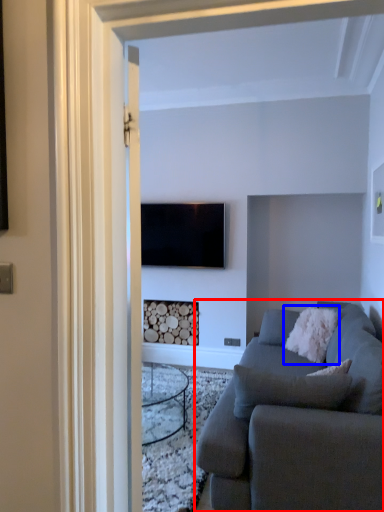
Question: Among these objects, which one is farthest to the camera, studio couch (highlighted by a red box) or pillow (highlighted by a blue box)?

Choices:
 (A) studio couch
 (B) pillow

Answer: (B)